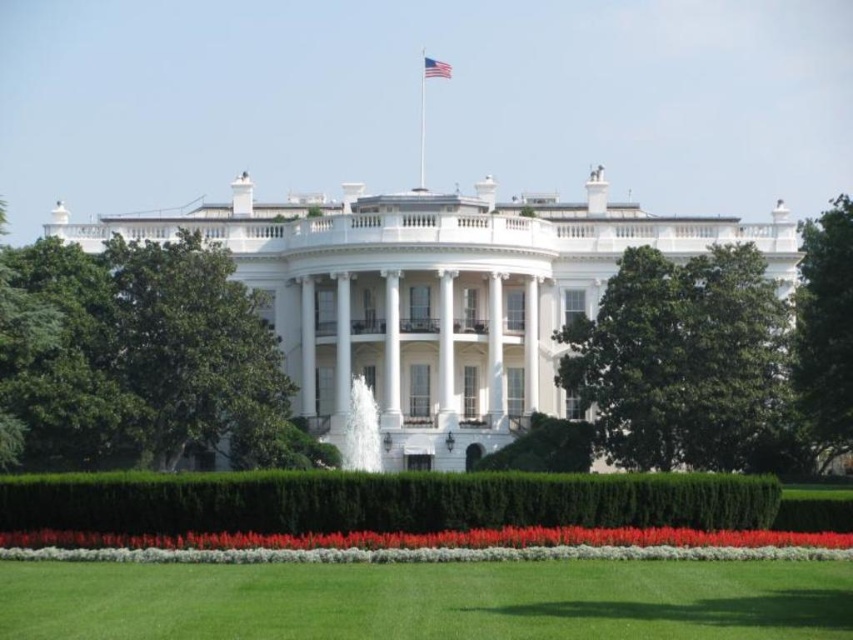
Question: Which point is closer to the camera?

Choices:
 (A) (828, 385)
 (B) (683, 412)
 (C) (28, 266)
 (D) (370, 500)

Answer: (D)

Question: Which point appears farthest from the camera in this image?

Choices:
 (A) (838, 296)
 (B) (105, 611)
 (C) (612, 284)

Answer: (C)

Question: In this image, where is green leafy tree at center located relative to american flag at center top?

Choices:
 (A) below
 (B) above

Answer: (A)

Question: Can you confirm if green grass at lower center is bigger than american flag at center top?

Choices:
 (A) yes
 (B) no

Answer: (A)

Question: Does green grass at lower center come in front of american flag at center top?

Choices:
 (A) yes
 (B) no

Answer: (A)

Question: Which object is the farthest from the green grass at lower center?

Choices:
 (A) green leafy tree at center
 (B) green leafy bush at center

Answer: (B)